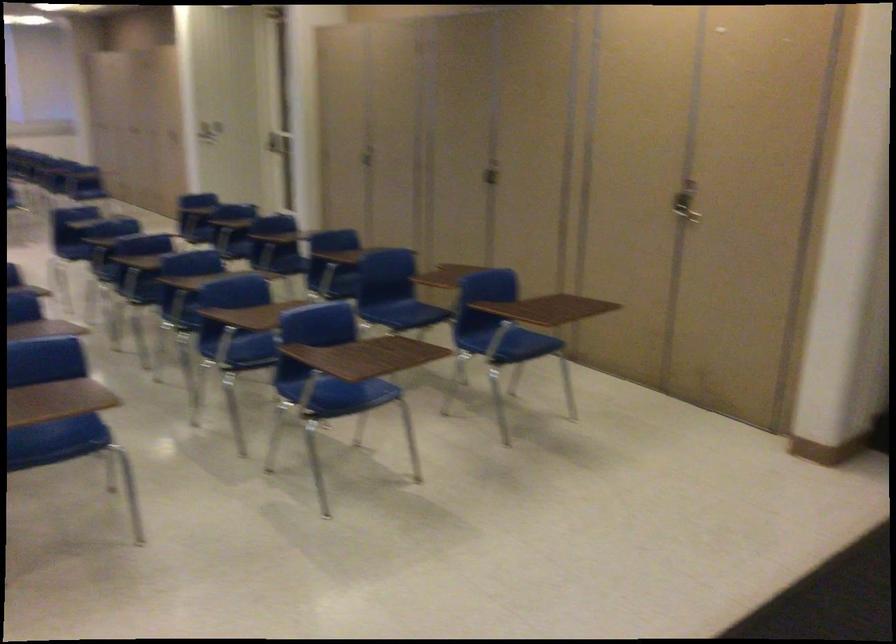
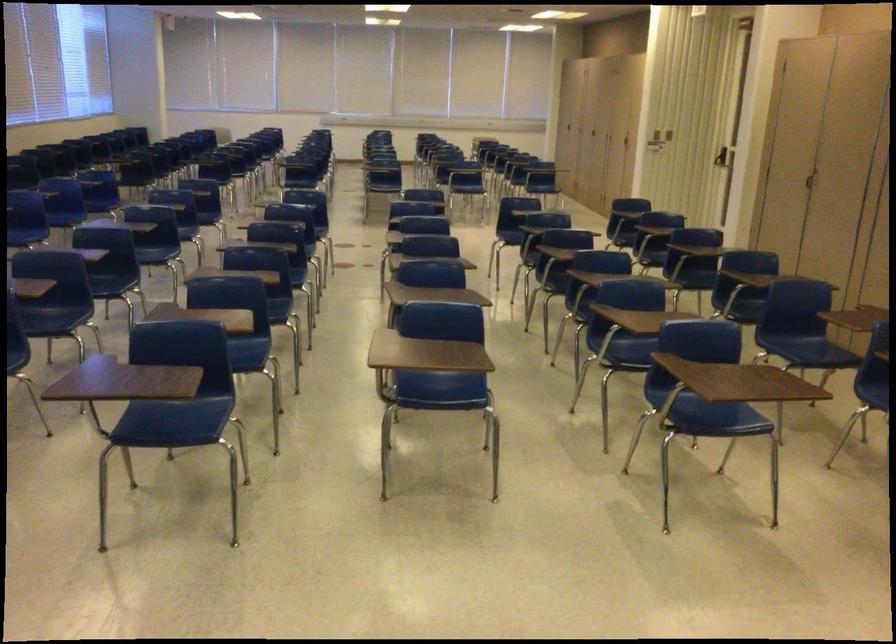
In the second image, find the point that corresponds to point (365, 154) in the first image.

(808, 180)